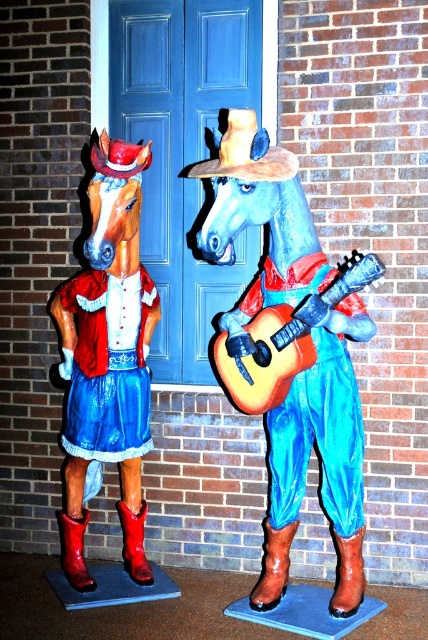
You are an art curator planning to move the matte red fabric horse at left and the red matte boot at lower left into a new exhibition space. The entrance of the exhibition has a doorway that is 1.5 meters wide. Can both objects pass through the doorway if placed side by side horizontally?

The matte red fabric horse at left is larger in size compared to the red matte boot at lower left. However, since the exact dimensions of each object are not provided, it is uncertain if their combined width when placed side by side would exceed the 1.5 meter doorway width. Additional measurements are needed to determine feasibility.

You are an art curator planning to place a new sculpture between the matte blue horse at center and the matte red fabric horse at left. The new sculpture is 1.2 meters wide. Can the space between them accommodate it?

The matte blue horse at center is wider than the matte red fabric horse at left. However, the description does not provide the exact distance between them, so it is unclear if the 1.2 meter sculpture will fit. Additional measurements are needed to determine this.

You are an art installer who needs to move the red matte boot at lower left to another location. Can you lift the boot without moving the matte red fabric horse at left?

The matte red fabric horse at left is positioned over the red matte boot at lower left, so you cannot lift the boot without moving the horse first.